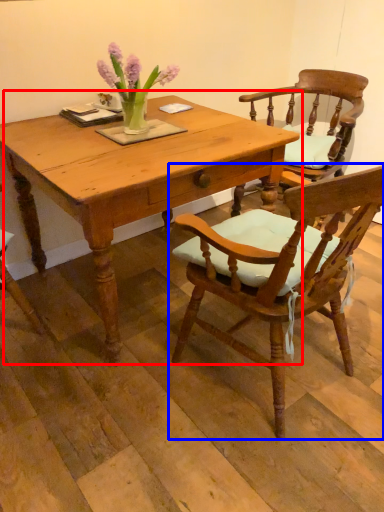
Question: Which of the following is the farthest to the observer, table (highlighted by a red box) or chair (highlighted by a blue box)?

Choices:
 (A) table
 (B) chair

Answer: (A)